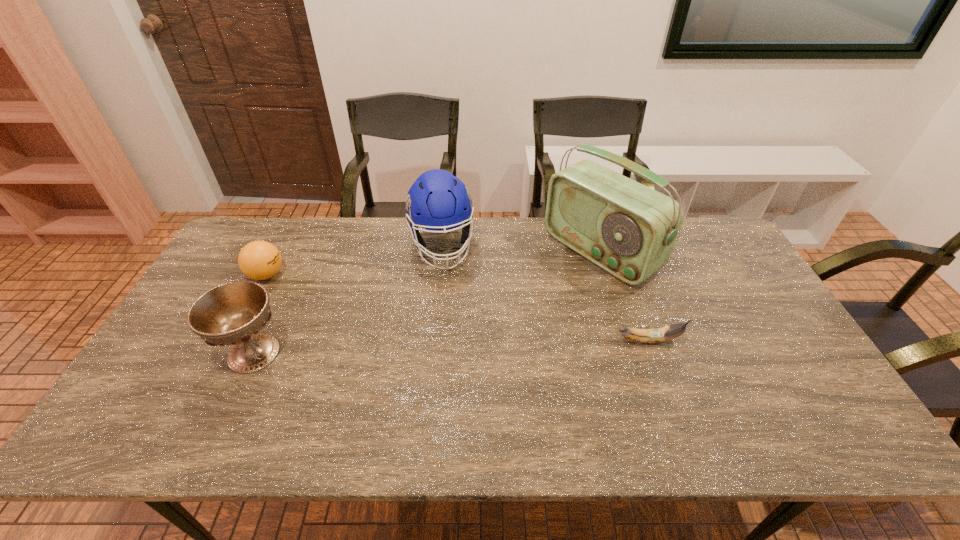
Where is `chalice`? chalice is located at coordinates pyautogui.click(x=234, y=313).

I want to click on banana, so click(656, 335).

The width and height of the screenshot is (960, 540). In order to click on the tallest object in this screenshot , I will do `click(628, 229)`.

Locate an element on the screen. the second shortest object is located at coordinates (259, 260).

Identify the location of the fourth shortest object. (437, 200).

Find the location of `football helmet`. football helmet is located at coordinates (437, 200).

Find the location of a particular element. This screenshot has width=960, height=540. blank area located 0.380m on the right of the chalice is located at coordinates (432, 353).

At what (x,y) coordinates should I click in order to perform the action: click on free spot located 0.090m on the peel of the banana. Please return your answer as a coordinate pair (x, y). Looking at the image, I should click on (715, 340).

What are the coordinates of `vacant point located 0.350m on the front panel of the tallest object` in the screenshot? It's located at (479, 335).

Locate an element on the screen. vacant space located 0.190m on the front panel of the tallest object is located at coordinates coord(521,308).